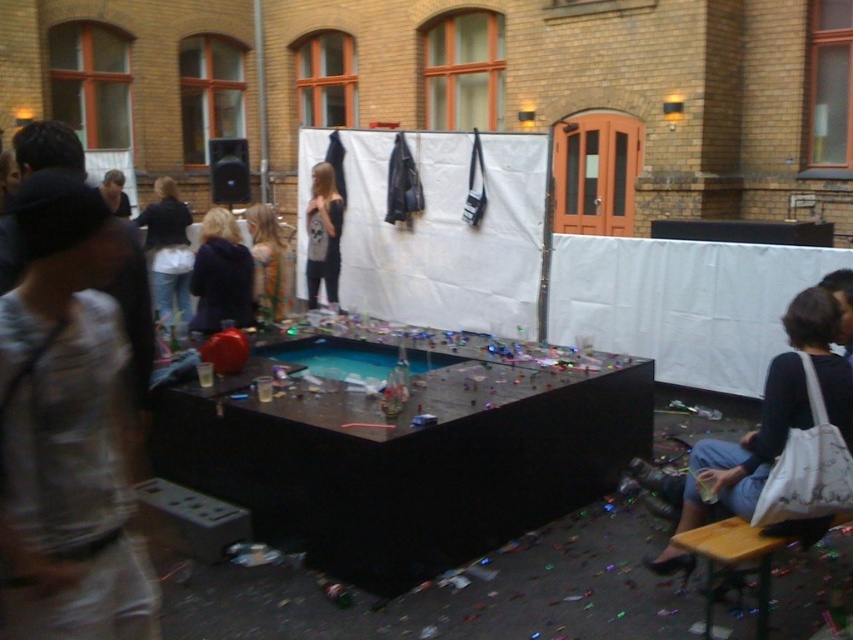
Does denim jacket at center have a greater height compared to matte gray sweater at center?

Indeed, denim jacket at center has a greater height compared to matte gray sweater at center.

How far apart are denim jacket at center and matte gray sweater at center?

denim jacket at center is 5.41 feet from matte gray sweater at center.

Identify the location of denim jacket at center. The image size is (853, 640). (167, 250).

Is the position of denim jacket at center less distant than that of shiny gold hair at center?

That is False.

Does denim jacket at center have a greater width compared to shiny gold hair at center?

Yes, denim jacket at center is wider than shiny gold hair at center.

Which is in front, point (149, 204) or point (279, 285)?

Positioned in front is point (279, 285).

Where is `denim jacket at center`? This screenshot has height=640, width=853. denim jacket at center is located at coordinates (167, 250).

Does point (798, 401) lie behind point (321, 195)?

That is False.

Which is below, white fabric bag at lower right or matte gray sweater at center?

Positioned lower is white fabric bag at lower right.

What are the coordinates of `white fabric bag at lower right` in the screenshot? It's located at (747, 449).